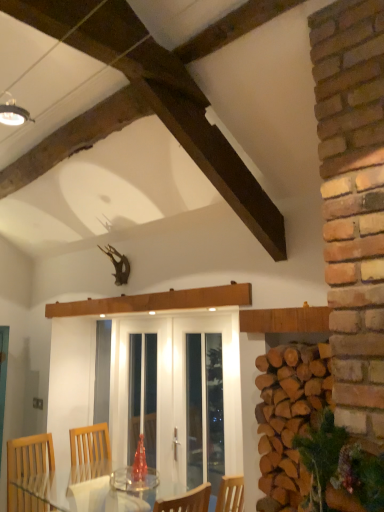
I want to click on blank space situated above white glass screen door at center, the 1th screen door positioned from the left (from a real-world perspective), so pos(157,316).